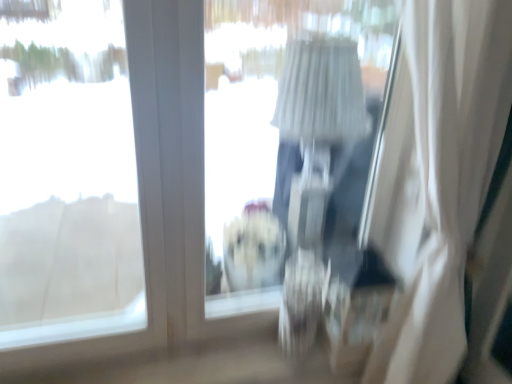
Question: Can you confirm if transparent plastic window screen at center is positioned to the right of white sheer curtain at right?

Choices:
 (A) yes
 (B) no

Answer: (B)

Question: Considering the relative sizes of transparent plastic window screen at center and white sheer curtain at right in the image provided, is transparent plastic window screen at center smaller than white sheer curtain at right?

Choices:
 (A) yes
 (B) no

Answer: (A)

Question: From the image's perspective, is transparent plastic window screen at center located above white sheer curtain at right?

Choices:
 (A) yes
 (B) no

Answer: (A)

Question: From a real-world perspective, is transparent plastic window screen at center positioned over white sheer curtain at right based on gravity?

Choices:
 (A) no
 (B) yes

Answer: (B)

Question: Is transparent plastic window screen at center thinner than white sheer curtain at right?

Choices:
 (A) yes
 (B) no

Answer: (A)

Question: Relative to white sheer curtain at right, is transparent plastic window screen at center in front or behind?

Choices:
 (A) front
 (B) behind

Answer: (B)

Question: Is transparent plastic window screen at center taller or shorter than white sheer curtain at right?

Choices:
 (A) tall
 (B) short

Answer: (B)

Question: Looking at their shapes, would you say transparent plastic window screen at center is wider or thinner than white sheer curtain at right?

Choices:
 (A) wide
 (B) thin

Answer: (B)

Question: Based on their sizes in the image, would you say transparent plastic window screen at center is bigger or smaller than white sheer curtain at right?

Choices:
 (A) small
 (B) big

Answer: (A)

Question: Is transparent glass window at upper left taller or shorter than white sheer curtain at right?

Choices:
 (A) short
 (B) tall

Answer: (A)

Question: Visually, is transparent glass window at upper left positioned to the left or to the right of white sheer curtain at right?

Choices:
 (A) right
 (B) left

Answer: (B)

Question: Is transparent glass window at upper left bigger or smaller than white sheer curtain at right?

Choices:
 (A) small
 (B) big

Answer: (A)

Question: Is transparent glass window at upper left in front of or behind white sheer curtain at right in the image?

Choices:
 (A) front
 (B) behind

Answer: (B)

Question: Does point [30, 127] appear closer or farther from the camera than point [373, 102]?

Choices:
 (A) closer
 (B) farther

Answer: (B)

Question: Based on their sizes in the image, would you say transparent glass window at upper left is bigger or smaller than transparent plastic window screen at center?

Choices:
 (A) big
 (B) small

Answer: (A)